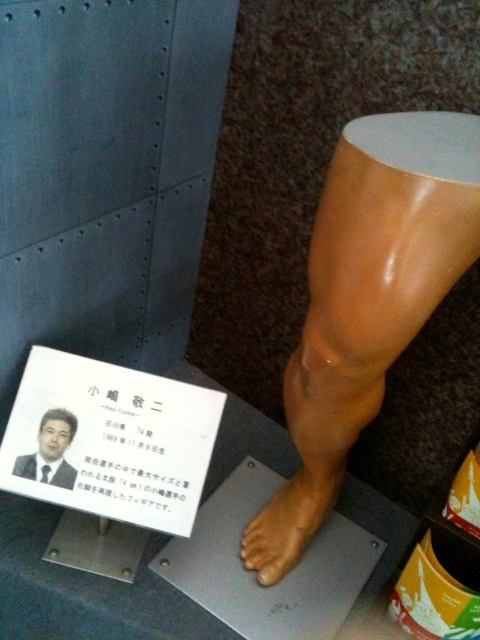
You are an art curator planning to move the matte brown foot at lower center and the matte black photo frame at lower left to a new exhibition space. The new space has a height restriction of 1.2 meters. Can both objects be moved without any adjustments?

The matte brown foot at lower center is much taller than the matte black photo frame at lower left. Since the height restriction is 1.2 meters, we need to confirm the exact height of the taller object. However, based on the description, the matte brown foot at lower center might exceed the height limit, so it may require adjustments before moving.

You are a visitor at an exhibition and want to take a photo of both the matte brown foot at lower center and the matte black photo frame at lower left. However, you notice that one of them is partially blocking the other. Which object is blocking the view of the other?

The matte black photo frame at lower left is behind the matte brown foot at lower center, so the matte brown foot at lower center is blocking the view of the matte black photo frame at lower left.

Consider the image. You are an art curator planning to install a new exhibit. You need to place a protective cover over both the matte brown foot at lower center and the matte black photo frame at lower left. Based on their sizes, which object requires a larger cover?

The matte brown foot at lower center might require a larger cover than the matte black photo frame at lower left because it might be wider.